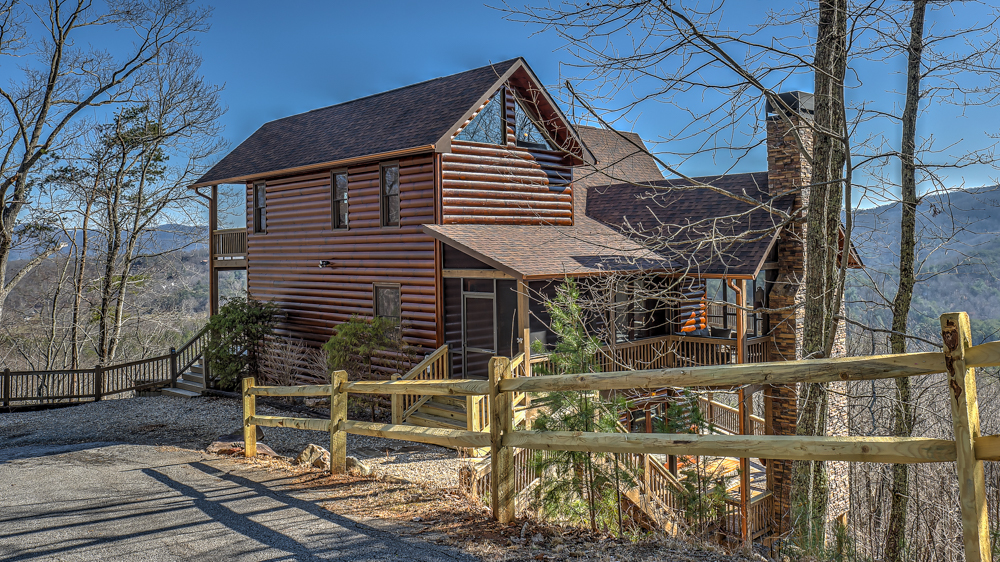
Find the location of a particular element. handrail is located at coordinates (296, 392), (426, 386), (661, 377), (986, 353).